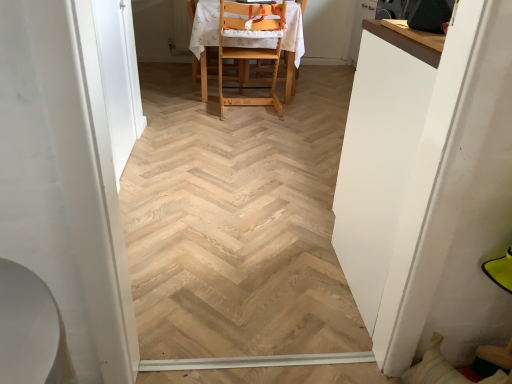
Question: Looking at the image, does light wood highchair at center seem bigger or smaller compared to white glossy screen door at left, the second screen door positioned from the back?

Choices:
 (A) big
 (B) small

Answer: (A)

Question: Is point (203, 94) positioned closer to the camera than point (102, 228)?

Choices:
 (A) closer
 (B) farther

Answer: (B)

Question: Based on their relative distances, which object is farther from the white glossy screen door at left, arranged as the first screen door when viewed from the front?

Choices:
 (A) light wood highchair at center
 (B) white glossy door at left, acting as the second screen door starting from the front
 (C) white glossy table at right

Answer: (A)

Question: Which object is the farthest from the white glossy screen door at left, arranged as the first screen door when viewed from the front?

Choices:
 (A) white glossy table at right
 (B) light wood highchair at center
 (C) white glossy door at left, acting as the second screen door starting from the front

Answer: (B)